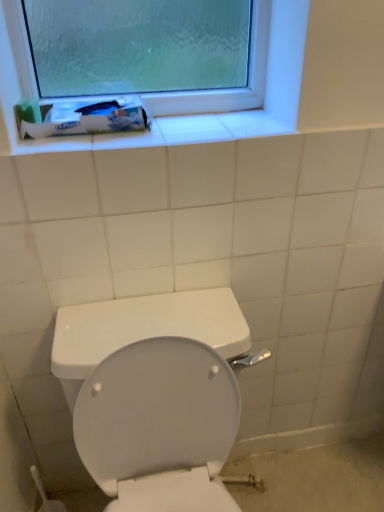
The height and width of the screenshot is (512, 384). Describe the element at coordinates (88, 118) in the screenshot. I see `white matte tube at upper left` at that location.

I want to click on white matte tube at upper left, so pyautogui.click(x=88, y=118).

Describe the element at coordinates (142, 351) in the screenshot. I see `white glossy toilet at center` at that location.

Find the location of a particular element. Image resolution: width=384 pixels, height=512 pixels. white glossy toilet at center is located at coordinates (142, 351).

The height and width of the screenshot is (512, 384). In order to click on white matte tube at upper left in this screenshot , I will do `click(88, 118)`.

Would you say white glossy toilet at center is to the left or to the right of white matte tube at upper left in the picture?

Clearly, white glossy toilet at center is on the right of white matte tube at upper left in the image.

From the picture: Which is in front, white glossy toilet at center or white matte tube at upper left?

white glossy toilet at center is closer to the camera.

Which is closer to the camera, [218,291] or [21,132]?

Point [218,291] is positioned farther from the camera compared to point [21,132].

From the image's perspective, between white glossy toilet at center and white matte tube at upper left, who is located below?

white glossy toilet at center appears lower in the image.

From a real-world perspective, is white glossy toilet at center physically below white matte tube at upper left?

Yes, from a real-world perspective, white glossy toilet at center is under white matte tube at upper left.

Can you confirm if white glossy toilet at center is thinner than white matte tube at upper left?

In fact, white glossy toilet at center might be wider than white matte tube at upper left.

From their relative heights in the image, would you say white glossy toilet at center is taller or shorter than white matte tube at upper left?

Considering their sizes, white glossy toilet at center has more height than white matte tube at upper left.

Is white glossy toilet at center bigger than white matte tube at upper left?

Indeed, white glossy toilet at center has a larger size compared to white matte tube at upper left.

Is white glossy toilet at center inside or outside of white matte tube at upper left?

white glossy toilet at center is located beyond the bounds of white matte tube at upper left.

Are white glossy toilet at center and white matte tube at upper left far apart?

No, white glossy toilet at center is not far away from white matte tube at upper left.

Is white glossy toilet at center oriented towards white matte tube at upper left?

No, white glossy toilet at center is not oriented towards white matte tube at upper left.

Can you tell me how much white glossy toilet at center and white matte tube at upper left differ in facing direction?

The angular difference between white glossy toilet at center and white matte tube at upper left is 0.808 degrees.

Find the location of `toilet below the white matte tube at upper left (from a real-world perspective)`. toilet below the white matte tube at upper left (from a real-world perspective) is located at coordinates (142, 351).

From the picture: Does white matte tube at upper left appear on the right side of white glossy toilet at center?

No, white matte tube at upper left is not to the right of white glossy toilet at center.

Is white matte tube at upper left further to camera compared to white glossy toilet at center?

That is True.

Is point (87, 116) positioned behind point (188, 311)?

No, (87, 116) is in front of (188, 311).

From the picture: From the image's perspective, between white matte tube at upper left and white glossy toilet at center, which one is located above?

white matte tube at upper left appears higher in the image.

From a real-world perspective, between white matte tube at upper left and white glossy toilet at center, who is vertically higher?

In real-world perspective, white matte tube at upper left is above.

Which object is thinner, white matte tube at upper left or white glossy toilet at center?

Thinner between the two is white matte tube at upper left.

Is white matte tube at upper left taller than white glossy toilet at center?

Incorrect, the height of white matte tube at upper left is not larger of that of white glossy toilet at center.

From the picture: Based on their sizes in the image, would you say white matte tube at upper left is bigger or smaller than white glossy toilet at center?

Clearly, white matte tube at upper left is smaller in size than white glossy toilet at center.

In the scene shown: Would you say white matte tube at upper left is outside white glossy toilet at center?

white matte tube at upper left lies outside white glossy toilet at center's area.

Is white matte tube at upper left placed right next to white glossy toilet at center?

No, white matte tube at upper left is not making contact with white glossy toilet at center.

Is white matte tube at upper left oriented away from white glossy toilet at center?

That's not correct — white matte tube at upper left is not looking away from white glossy toilet at center.

How different are the orientations of white matte tube at upper left and white glossy toilet at center in degrees?

The angle between the facing direction of white matte tube at upper left and the facing direction of white glossy toilet at center is 0.808 degrees.

Based on the photo, measure the distance between white matte tube at upper left and white glossy toilet at center.

The distance of white matte tube at upper left from white glossy toilet at center is 21.28 inches.

You are a GUI agent. You are given a task and a screenshot of the screen. Output one action in this format:
    pyautogui.click(x=<x>, y=<y>)
    Task: Click on the toothpaste on the left of white glossy toilet at center
    
    Given the screenshot: What is the action you would take?
    pyautogui.click(x=88, y=118)

In order to click on toothpaste above the white glossy toilet at center (from a real-world perspective) in this screenshot , I will do `click(88, 118)`.

Where is `toilet below the white matte tube at upper left (from the image's perspective)`? toilet below the white matte tube at upper left (from the image's perspective) is located at coordinates (142, 351).